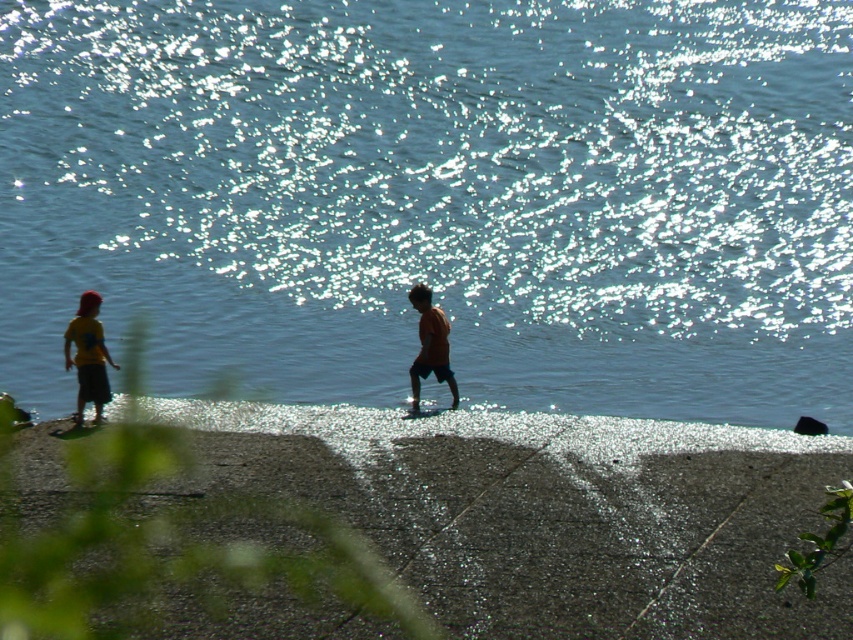
Describe the element at coordinates (439, 198) in the screenshot. The width and height of the screenshot is (853, 640). I see `blue water at center` at that location.

Looking at this image, who is more distant from viewer, (289, 19) or (579, 419)?

The point (289, 19) is behind.

Is point (171, 344) positioned after point (277, 413)?

That is True.

The image size is (853, 640). Identify the location of blue water at center. tap(439, 198).

Can you confirm if smooth concrete sidewalk at lower center is positioned below orange matte shirt at center?

Indeed, smooth concrete sidewalk at lower center is positioned under orange matte shirt at center.

Which is above, smooth concrete sidewalk at lower center or orange matte shirt at center?

Positioned higher is orange matte shirt at center.

You are a GUI agent. You are given a task and a screenshot of the screen. Output one action in this format:
    pyautogui.click(x=<x>, y=<y>)
    Task: Click on the smooth concrete sidewalk at lower center
    Image resolution: width=853 pixels, height=640 pixels.
    Given the screenshot: What is the action you would take?
    pyautogui.click(x=549, y=513)

Where is `smooth concrete sidewalk at lower center`? The width and height of the screenshot is (853, 640). smooth concrete sidewalk at lower center is located at coordinates (549, 513).

Is point (403, 454) positioned in front of point (94, 337)?

That is True.

Locate an element on the screen. This screenshot has height=640, width=853. smooth concrete sidewalk at lower center is located at coordinates (549, 513).